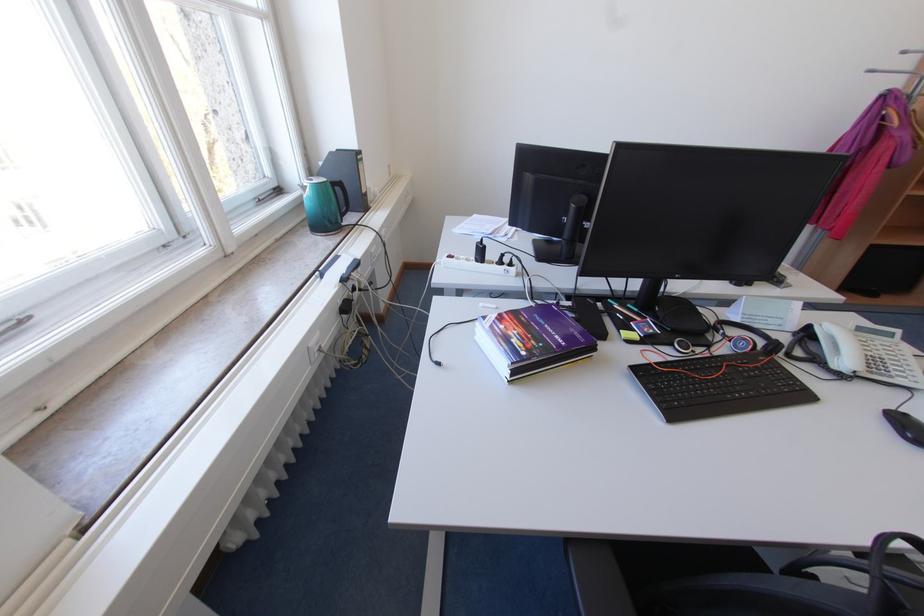
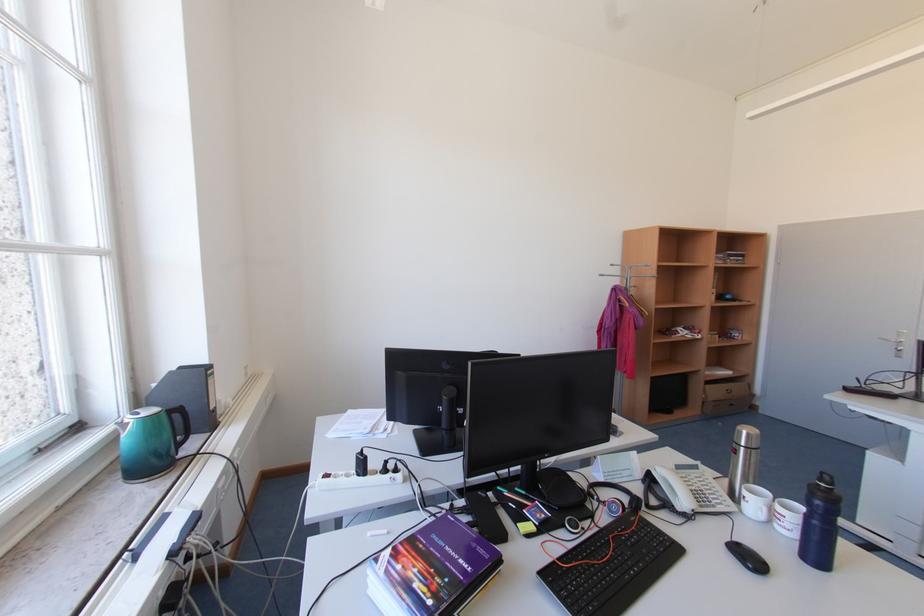
The point at (842, 368) is marked in the first image. Where is the corresponding point in the second image?

(687, 509)